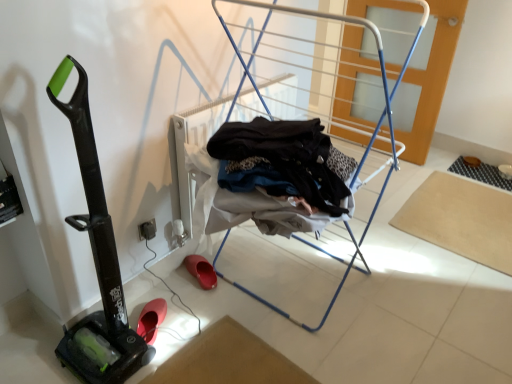
You are a GUI agent. You are given a task and a screenshot of the screen. Output one action in this format:
    pyautogui.click(x=<x>, y=<y>)
    Task: Click on the vacant area that is situated to the right of rubber/matte clog at lower left, arranged as the 2th footwear when ordered from the bottom
    
    Given the screenshot: What is the action you would take?
    pyautogui.click(x=238, y=269)